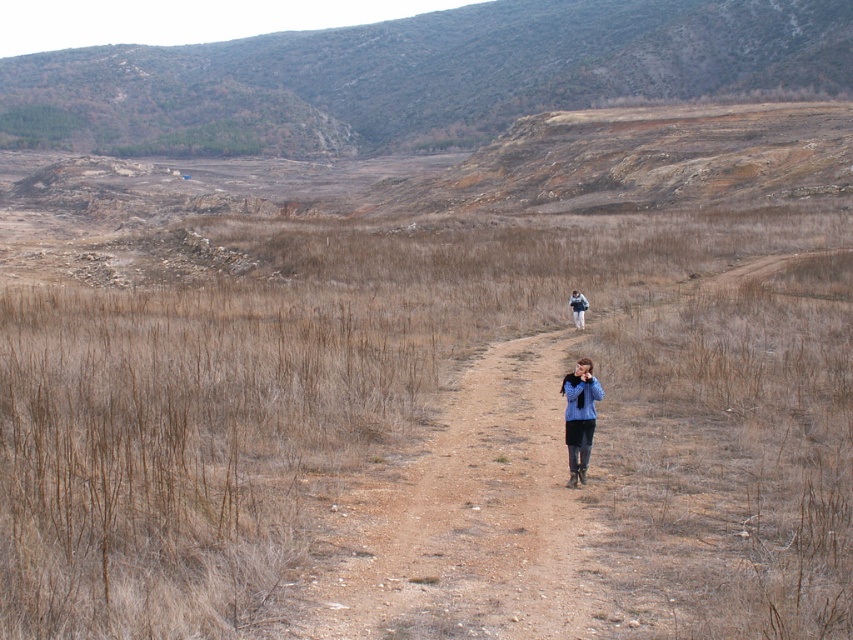
Question: Which point is farther to the camera?

Choices:
 (A) brown dry grass at center
 (B) blue fabric jacket at center
 (C) green textured hillside at upper center

Answer: (C)

Question: Can you confirm if brown dry grass at center is bigger than blue denim jacket at center?

Choices:
 (A) yes
 (B) no

Answer: (A)

Question: Is green textured hillside at upper center bigger than blue fabric jacket at center?

Choices:
 (A) no
 (B) yes

Answer: (B)

Question: Which object is the farthest from the brown dry grass at center?

Choices:
 (A) blue fabric jacket at center
 (B) blue denim jacket at center

Answer: (A)

Question: Which point is farther from the camera taking this photo?

Choices:
 (A) (575, 449)
 (B) (242, 371)

Answer: (B)

Question: In this image, where is green textured hillside at upper center located relative to blue denim jacket at center?

Choices:
 (A) above
 (B) below

Answer: (A)